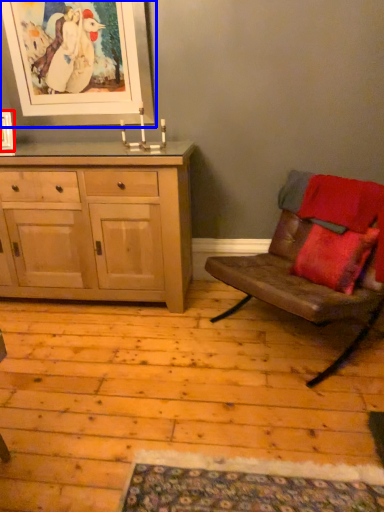
Question: Which of the following is the farthest to the observer, picture frame (highlighted by a red box) or picture frame (highlighted by a blue box)?

Choices:
 (A) picture frame
 (B) picture frame

Answer: (A)